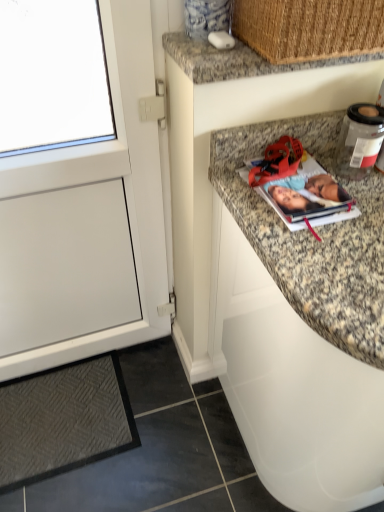
I want to click on vacant space situated above matte paper photo album at upper right (from a real-world perspective), so click(304, 177).